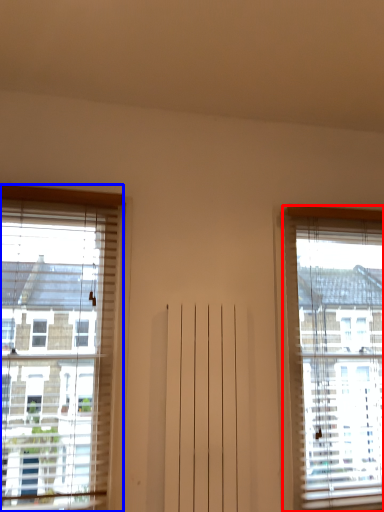
Question: Which of the following is the closest to the observer, window (highlighted by a red box) or window (highlighted by a blue box)?

Choices:
 (A) window
 (B) window

Answer: (B)